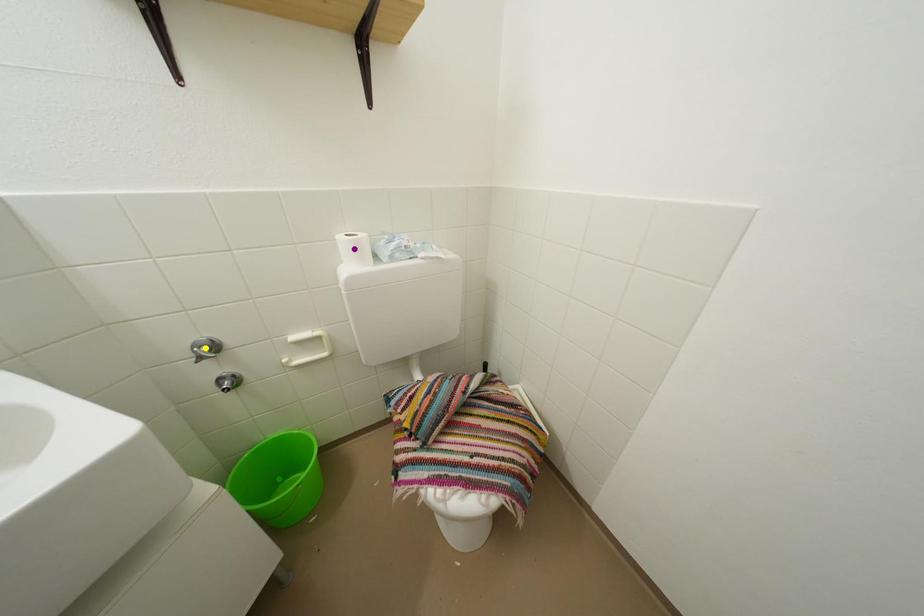
Order these from nearest to farthest:
yellow point
purple point
green point

yellow point → purple point → green point